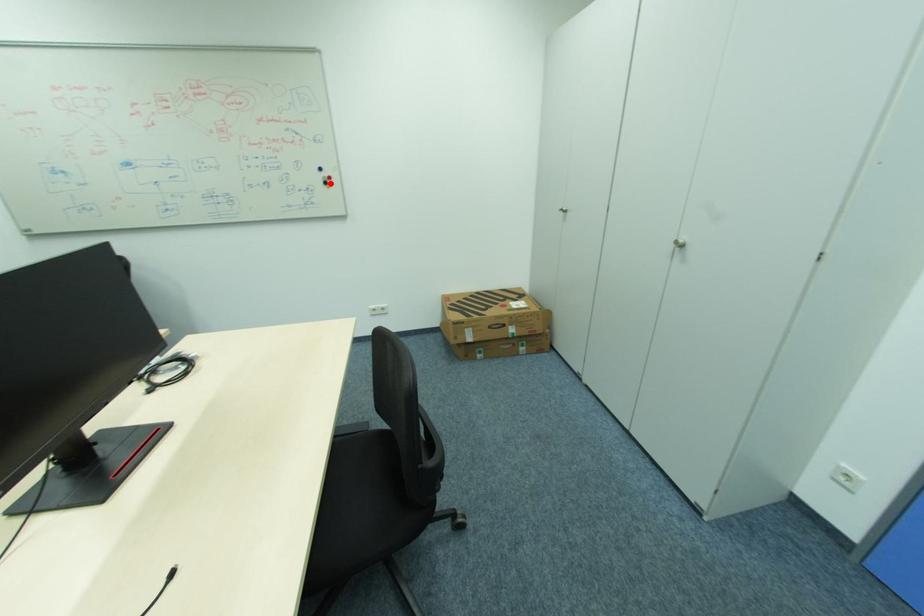
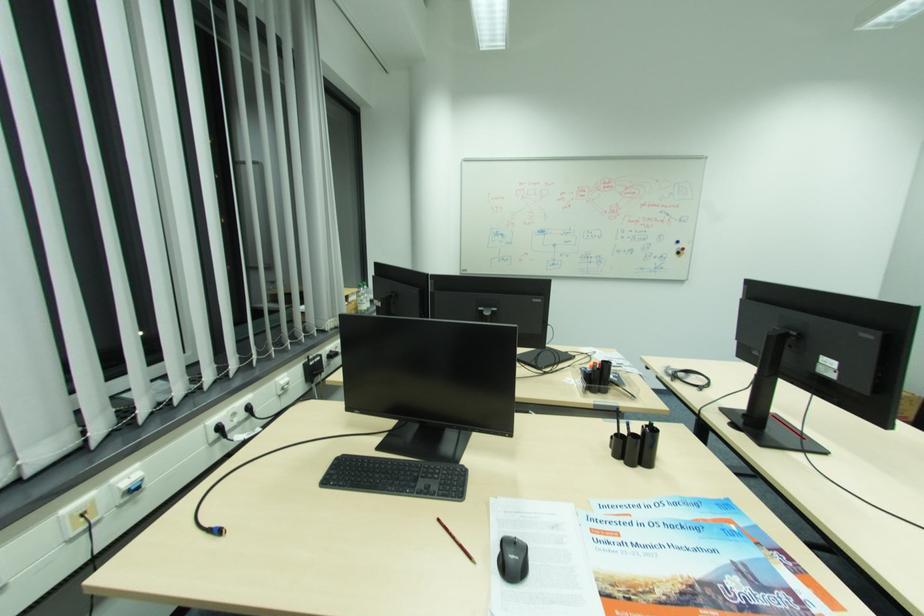
Question: I am providing you with two images of the same scene from different viewpoints. Image1 has a red point marked. In image2, the corresponding 3D location appears at what relative position? Reply with the corresponding letter.

Choices:
 (A) Closer
 (B) Farther

Answer: (B)